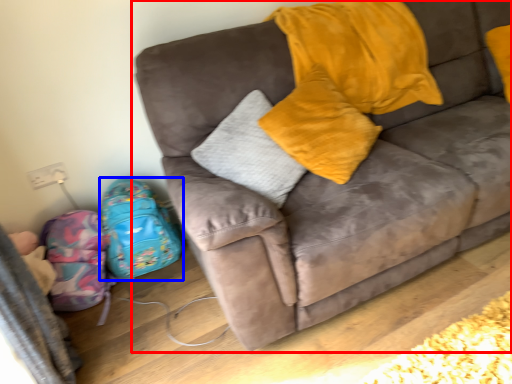
Question: Which object is further to the camera taking this photo, studio couch (highlighted by a red box) or luggage (highlighted by a blue box)?

Choices:
 (A) studio couch
 (B) luggage

Answer: (B)